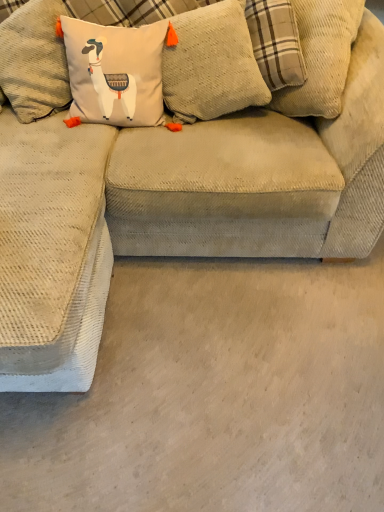
Identify the location of textured beige pillow at upper center. This screenshot has width=384, height=512. (211, 64).

This screenshot has width=384, height=512. Describe the element at coordinates (211, 64) in the screenshot. I see `textured beige pillow at upper center` at that location.

Describe the element at coordinates (215, 394) in the screenshot. The image size is (384, 512). I see `beige corduroy couch at center` at that location.

This screenshot has width=384, height=512. What are the coordinates of `beige corduroy couch at center` in the screenshot? It's located at (215, 394).

Where is `textured beige pillow at upper center`? The height and width of the screenshot is (512, 384). textured beige pillow at upper center is located at coordinates (211, 64).

Considering the relative positions of beige corduroy couch at center and textured beige pillow at upper center in the image provided, is beige corduroy couch at center to the left of textured beige pillow at upper center from the viewer's perspective?

Incorrect, beige corduroy couch at center is not on the left side of textured beige pillow at upper center.

Which object is closer to the camera taking this photo, beige corduroy couch at center or textured beige pillow at upper center?

Positioned in front is beige corduroy couch at center.

Which is closer, (290, 283) or (175, 50)?

The point (175, 50) is more forward.

From the image's perspective, between beige corduroy couch at center and textured beige pillow at upper center, which one is located above?

beige corduroy couch at center.

From a real-world perspective, which is physically above, beige corduroy couch at center or textured beige pillow at upper center?

textured beige pillow at upper center, from a real-world perspective.

Considering the relative sizes of beige corduroy couch at center and textured beige pillow at upper center in the image provided, is beige corduroy couch at center wider than textured beige pillow at upper center?

Yes, beige corduroy couch at center is wider than textured beige pillow at upper center.

Which of these two, beige corduroy couch at center or textured beige pillow at upper center, stands taller?

With more height is textured beige pillow at upper center.

Based on their sizes in the image, would you say beige corduroy couch at center is bigger or smaller than textured beige pillow at upper center?

Clearly, beige corduroy couch at center is larger in size than textured beige pillow at upper center.

Can we say beige corduroy couch at center lies outside textured beige pillow at upper center?

Absolutely, beige corduroy couch at center is external to textured beige pillow at upper center.

Does beige corduroy couch at center touch textured beige pillow at upper center?

No, beige corduroy couch at center is not touching textured beige pillow at upper center.

Is beige corduroy couch at center positioned with its back to textured beige pillow at upper center?

No, beige corduroy couch at center's orientation is not away from textured beige pillow at upper center.

Find the location of a particular element. This screenshot has width=384, height=512. pillow on the left of beige corduroy couch at center is located at coordinates click(211, 64).

Which object is positioned more to the left, textured beige pillow at upper center or beige corduroy couch at center?

Positioned to the left is textured beige pillow at upper center.

Between textured beige pillow at upper center and beige corduroy couch at center, which one is positioned behind?

textured beige pillow at upper center is further away from the camera.

Is point (189, 122) closer or farther from the camera than point (213, 323)?

Point (189, 122) is positioned farther from the camera compared to point (213, 323).

From the image's perspective, does textured beige pillow at upper center appear higher than beige corduroy couch at center?

No, from the image's perspective, textured beige pillow at upper center is not over beige corduroy couch at center.

From a real-world perspective, is textured beige pillow at upper center under beige corduroy couch at center?

No, from a real-world perspective, textured beige pillow at upper center is not under beige corduroy couch at center.

Consider the image. Does textured beige pillow at upper center have a greater width compared to beige corduroy couch at center?

In fact, textured beige pillow at upper center might be narrower than beige corduroy couch at center.

From their relative heights in the image, would you say textured beige pillow at upper center is taller or shorter than beige corduroy couch at center?

textured beige pillow at upper center is taller than beige corduroy couch at center.

Is textured beige pillow at upper center bigger than beige corduroy couch at center?

No.

Which is correct: textured beige pillow at upper center is inside beige corduroy couch at center, or outside of it?

textured beige pillow at upper center is located beyond the bounds of beige corduroy couch at center.

From the picture: Is textured beige pillow at upper center not near beige corduroy couch at center?

No, textured beige pillow at upper center is not far from beige corduroy couch at center.

Is textured beige pillow at upper center facing away from beige corduroy couch at center?

No, textured beige pillow at upper center is not facing away from beige corduroy couch at center.

How different are the orientations of textured beige pillow at upper center and beige corduroy couch at center in degrees?

textured beige pillow at upper center and beige corduroy couch at center are facing 9.45 degrees away from each other.

The image size is (384, 512). I want to click on pillow that appears below the beige corduroy couch at center (from the image's perspective), so click(211, 64).

Identify the location of concrete that appears on the right of textured beige pillow at upper center. (215, 394).

In the image, there is a textured beige pillow at upper center. At what (x,y) coordinates should I click in order to perform the action: click on concrete below it (from a real-world perspective). Please return your answer as a coordinate pair (x, y). The width and height of the screenshot is (384, 512). Looking at the image, I should click on (215, 394).